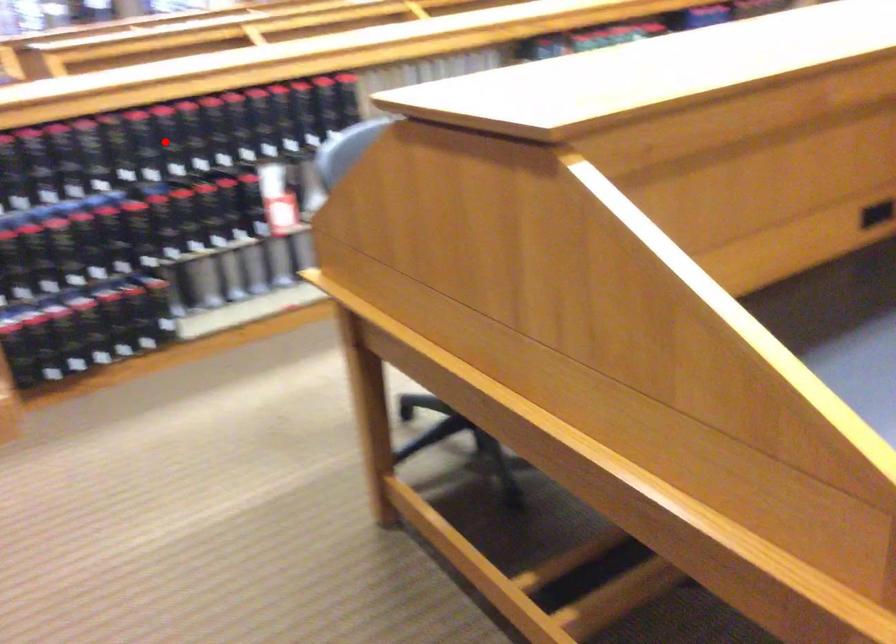
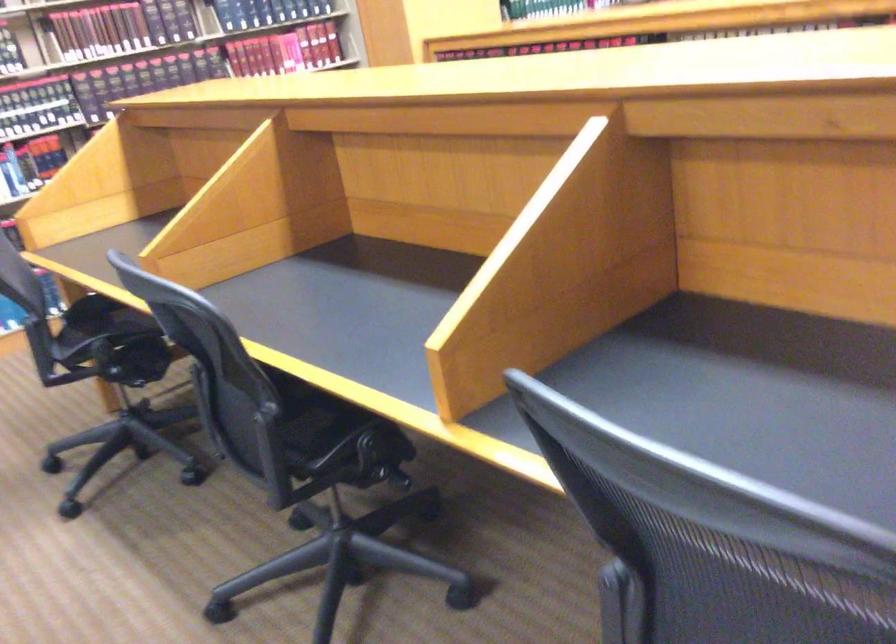
Question: I am providing you with two images of the same scene from different viewpoints. A red point is marked on the first image. At the location where the point appears in image 1, is it still visible in image 2?

Choices:
 (A) Yes
 (B) No

Answer: (B)